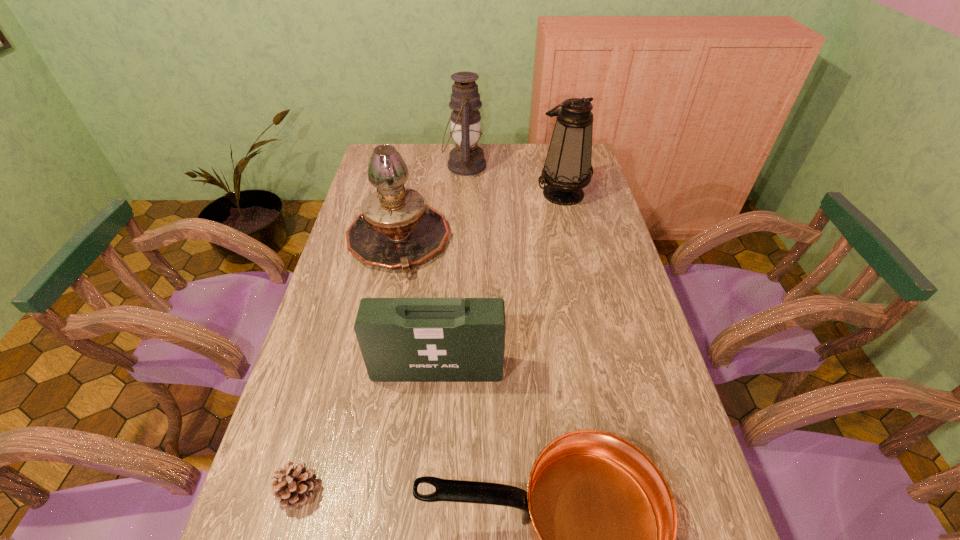
The image size is (960, 540). I want to click on the rightmost oil lamp, so coord(567,169).

Where is `the third shortest object`? the third shortest object is located at coordinates (401, 339).

Where is `the fourth farthest object`? The image size is (960, 540). the fourth farthest object is located at coordinates (401, 339).

The width and height of the screenshot is (960, 540). Find the location of `pinecone`. pinecone is located at coordinates (293, 487).

The height and width of the screenshot is (540, 960). What are the coordinates of `vacant space located on the back of the rightmost oil lamp` in the screenshot? It's located at (554, 152).

The image size is (960, 540). Find the location of `vacant area located on the front-facing side of the fourth farthest object`. vacant area located on the front-facing side of the fourth farthest object is located at coordinates (425, 521).

You are a GUI agent. You are given a task and a screenshot of the screen. Output one action in this format:
    pyautogui.click(x=<x>, y=<y>)
    Task: Click on the vacant space located 0.180m on the back of the pinecone
    The height and width of the screenshot is (540, 960).
    Given the screenshot: What is the action you would take?
    pyautogui.click(x=325, y=395)

Where is `object situated at the far edge`? This screenshot has width=960, height=540. object situated at the far edge is located at coordinates (467, 159).

Locate an element on the screen. This screenshot has height=540, width=960. oil lamp located in the left edge section of the desktop is located at coordinates (396, 229).

Identify the location of pinecone located at the left edge. (293, 487).